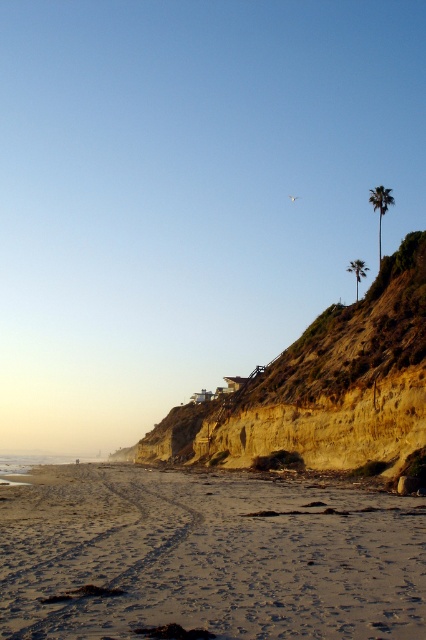
Question: Is sandy beach at lower left to the left of green leafy palm tree at right from the viewer's perspective?

Choices:
 (A) yes
 (B) no

Answer: (A)

Question: Which object is farther from the camera taking this photo?

Choices:
 (A) green leafy palm tree at right
 (B) brown/dry soil cliff at center-right

Answer: (A)

Question: Estimate the real-world distances between objects in this image. Which object is farther from the sandy beach at lower left?

Choices:
 (A) brown/dry soil cliff at center-right
 (B) green leafy palm tree at upper right
 (C) green leafy palm tree at right

Answer: (C)

Question: Where is green leafy palm tree at upper right located in relation to green leafy palm tree at right in the image?

Choices:
 (A) left
 (B) right

Answer: (B)

Question: Which object is positioned closest to the sandy beach at lower left?

Choices:
 (A) green leafy palm tree at right
 (B) green leafy palm tree at upper right

Answer: (B)

Question: Is brown/dry soil cliff at center-right below green leafy palm tree at upper right?

Choices:
 (A) yes
 (B) no

Answer: (A)